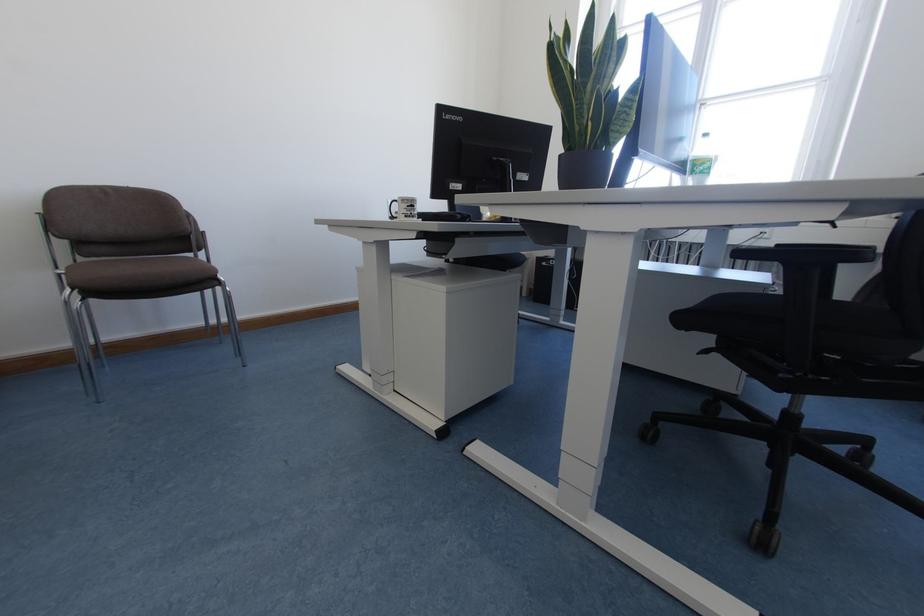
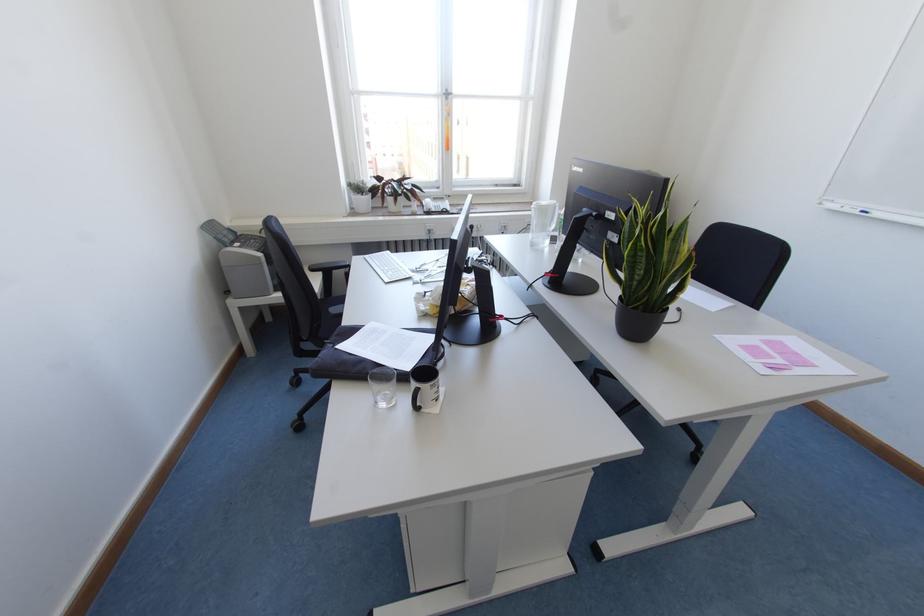
Question: I am providing you with two images of the same scene from different viewpoints. After the viewpoint changes to image2, which objects are now occluded?

Choices:
 (A) black chair armrest
 (B) black mug handle
 (C) window handle
 (D) black cabinet knob

Answer: (A)